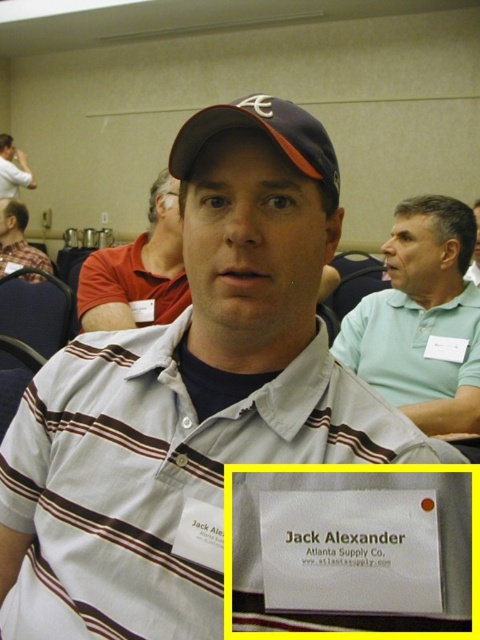
Question: Is light green polo shirt at right closer to camera compared to matte black baseball cap at upper center?

Choices:
 (A) no
 (B) yes

Answer: (A)

Question: Among these objects, which one is farthest from the camera?

Choices:
 (A) matte red shirt at left
 (B) light green polo shirt at right
 (C) matte black baseball cap at upper center

Answer: (A)

Question: Which object is positioned closest to the matte black cap at center?

Choices:
 (A) matte black cap at upper center
 (B) gray striped shirt at center

Answer: (B)

Question: Where is matte red shirt at left located in relation to gray striped shirt at center in the image?

Choices:
 (A) below
 (B) above

Answer: (B)

Question: Can you confirm if matte black baseball cap at upper center is positioned above matte red shirt at left?

Choices:
 (A) no
 (B) yes

Answer: (A)

Question: Which point is closer to the camera taking this photo?

Choices:
 (A) (16, 188)
 (B) (264, 99)

Answer: (B)